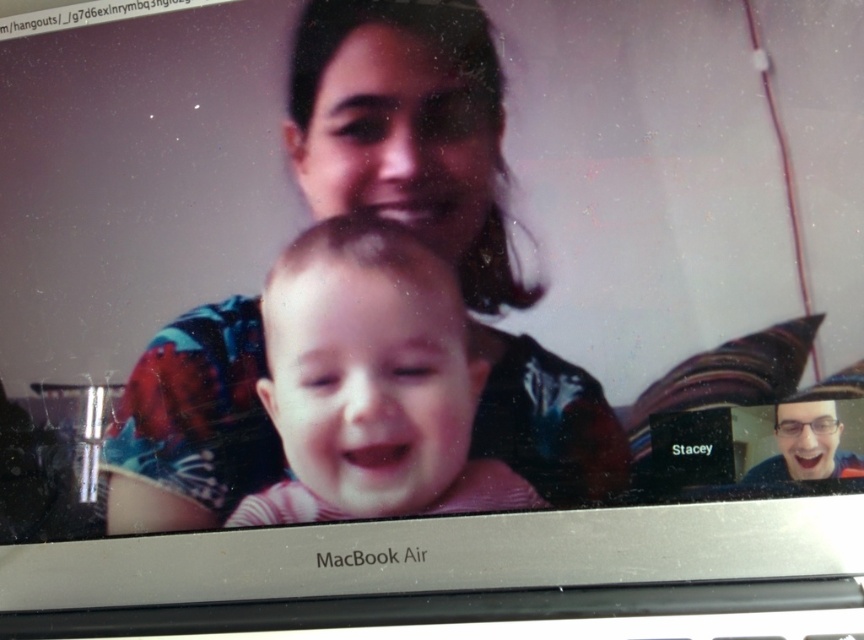
Does pink striped shirt at center have a greater width compared to glossy black glasses at upper right?

Yes, pink striped shirt at center is wider than glossy black glasses at upper right.

Does pink striped shirt at center appear over glossy black glasses at upper right?

Yes, pink striped shirt at center is above glossy black glasses at upper right.

Who is more forward, (269, 380) or (793, 444)?

Point (793, 444) is in front.

This screenshot has height=640, width=864. Identify the location of pink striped shirt at center. tap(372, 384).

Is matte black shirt at center below glossy black glasses at upper right?

Actually, matte black shirt at center is above glossy black glasses at upper right.

Locate an element on the screen. This screenshot has width=864, height=640. matte black shirt at center is located at coordinates (407, 129).

This screenshot has height=640, width=864. What are the coordinates of `matte black shirt at center` in the screenshot? It's located at (407, 129).

Between point (503, 164) and point (391, 508), which one is positioned in front?

Point (503, 164) is more forward.

Locate an element on the screen. matte black shirt at center is located at coordinates (407, 129).